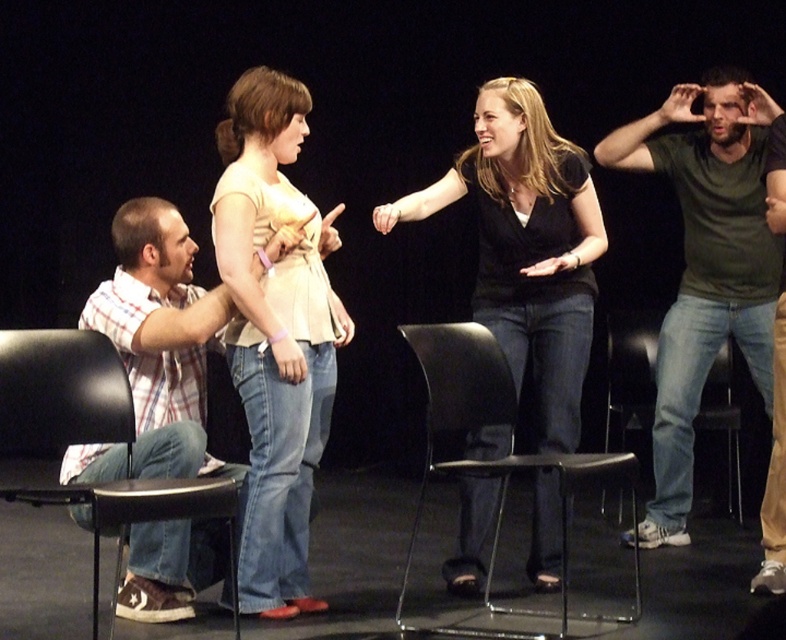
This screenshot has height=640, width=786. What do you see at coordinates (526, 246) in the screenshot?
I see `black matte shirt at center` at bounding box center [526, 246].

Which of these two, black matte shirt at center or black plastic chair at lower left, stands shorter?

black plastic chair at lower left is shorter.

Is point (564, 161) positioned behind point (10, 378)?

That is True.

Where is `black matte shirt at center`? The width and height of the screenshot is (786, 640). black matte shirt at center is located at coordinates (526, 246).

In the scene shown: Does black matte shirt at center have a smaller size compared to denim fabric chair at right?

No, black matte shirt at center is not smaller than denim fabric chair at right.

Is black matte shirt at center shorter than denim fabric chair at right?

No.

What do you see at coordinates (526, 246) in the screenshot? I see `black matte shirt at center` at bounding box center [526, 246].

Locate an element on the screen. black matte shirt at center is located at coordinates (526, 246).

Which is in front, point (219, 124) or point (761, 305)?

Point (219, 124) is in front.

Can you confirm if denim jeans at center is bigger than green matte shirt at center?

No.

Which is in front, point (300, 449) or point (623, 148)?

Positioned in front is point (300, 449).

Where is `denim jeans at center`? The height and width of the screenshot is (640, 786). denim jeans at center is located at coordinates pos(274,337).